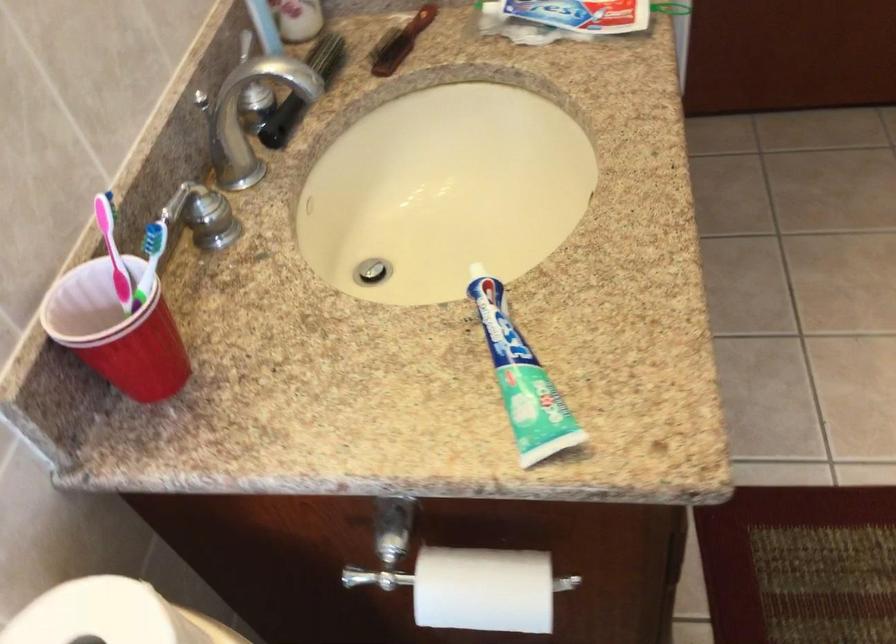
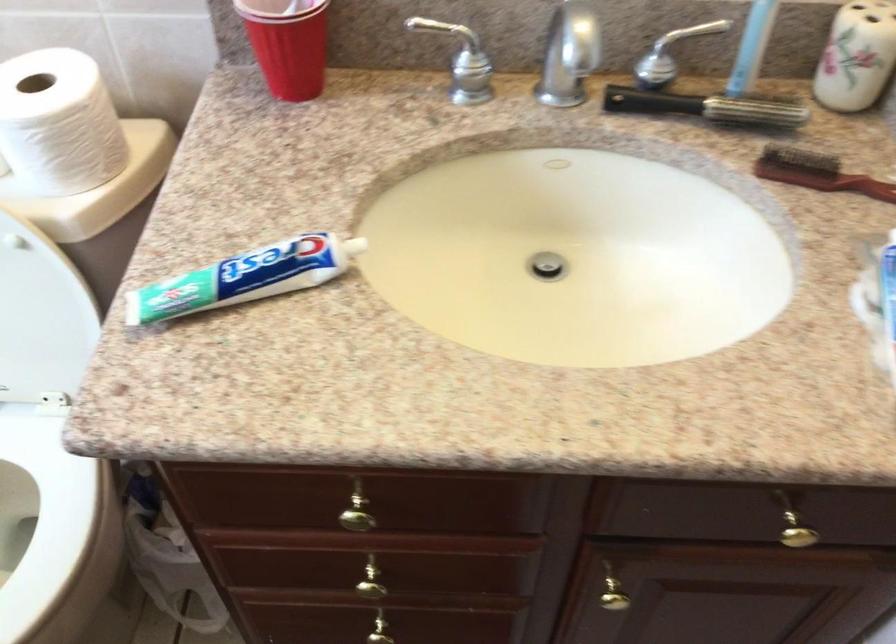
Find the pixel in the second image that matches [694,337] in the first image.

(358, 509)